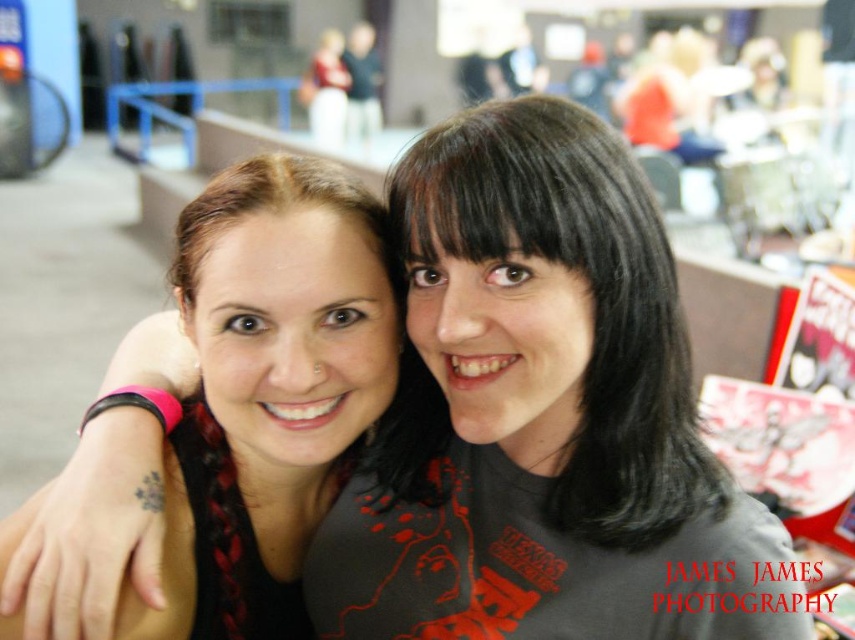
Who is taller, black matte hair at center or matte black shirt at center?

With more height is matte black shirt at center.

Consider the image. Can you confirm if black matte hair at center is positioned to the left of matte black shirt at center?

Incorrect, black matte hair at center is not on the left side of matte black shirt at center.

Find the location of a particular element. black matte hair at center is located at coordinates (555, 323).